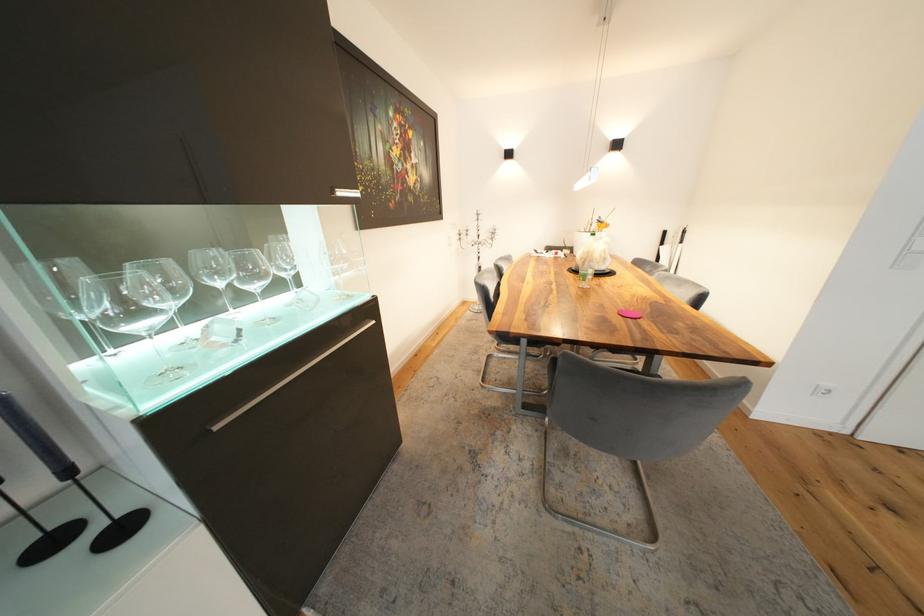
You are a GUI agent. You are given a task and a screenshot of the screen. Output one action in this format:
    pyautogui.click(x=<x>, y=<y>)
    Task: Click on the silver cabinet handle
    This screenshot has width=924, height=616.
    Given the screenshot: What is the action you would take?
    (x=346, y=192)